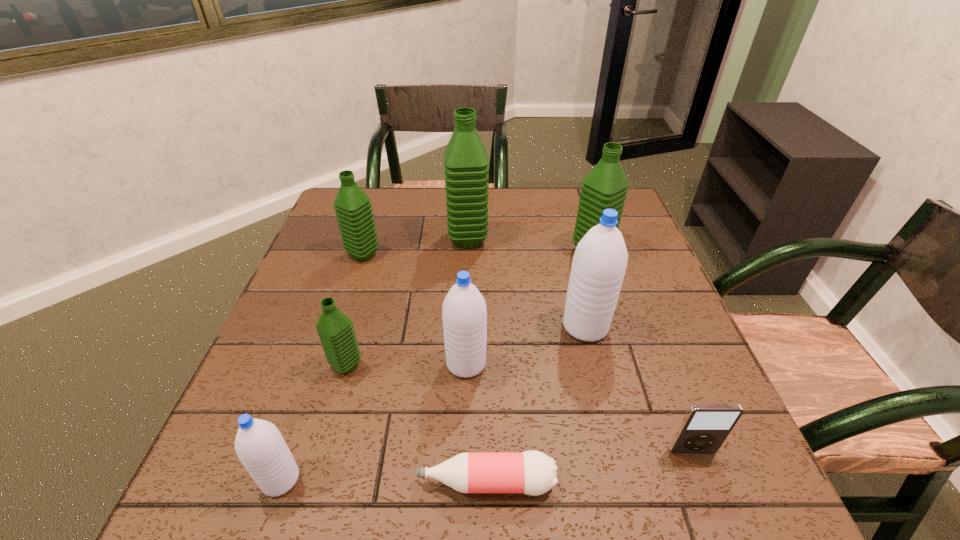
Locate an element on the screen. The height and width of the screenshot is (540, 960). vacant region between the farthest blue water bottle and the smallest blue water bottle is located at coordinates click(433, 403).

This screenshot has height=540, width=960. Identify the location of vacant space in between the eighth tallest object and the bottle. (589, 467).

At what (x,y) coordinates should I click in order to perform the action: click on empty space between the bottle and the nearest green water bottle. Please return your answer as a coordinate pair (x, y). Looking at the image, I should click on (417, 424).

Where is `vacant area that lies between the iPod and the second biggest blue water bottle`? The width and height of the screenshot is (960, 540). vacant area that lies between the iPod and the second biggest blue water bottle is located at coordinates (579, 407).

Identify which object is the second closest to the third biggest green water bottle. Please provide its 2D coordinates. Your answer should be formatted as a tuple, i.e. [(x, y)], where the tuple contains the x and y coordinates of a point satisfying the conditions above.

[(336, 332)]

The image size is (960, 540). I want to click on object that stands as the seventh closest to the nearest blue water bottle, so click(x=705, y=427).

Image resolution: width=960 pixels, height=540 pixels. Identify the location of the second closest water bottle to the rightmost green water bottle. (466, 162).

The width and height of the screenshot is (960, 540). I want to click on water bottle identified as the sixth closest to the rightmost blue water bottle, so click(260, 447).

Point out which green water bottle is positioned as the fourth nearest to the second biggest blue water bottle. Please provide its 2D coordinates. Your answer should be formatted as a tuple, i.e. [(x, y)], where the tuple contains the x and y coordinates of a point satisfying the conditions above.

[(605, 187)]

Locate an element on the screen. This screenshot has width=960, height=540. green water bottle that is the second closest to the smallest blue water bottle is located at coordinates (353, 208).